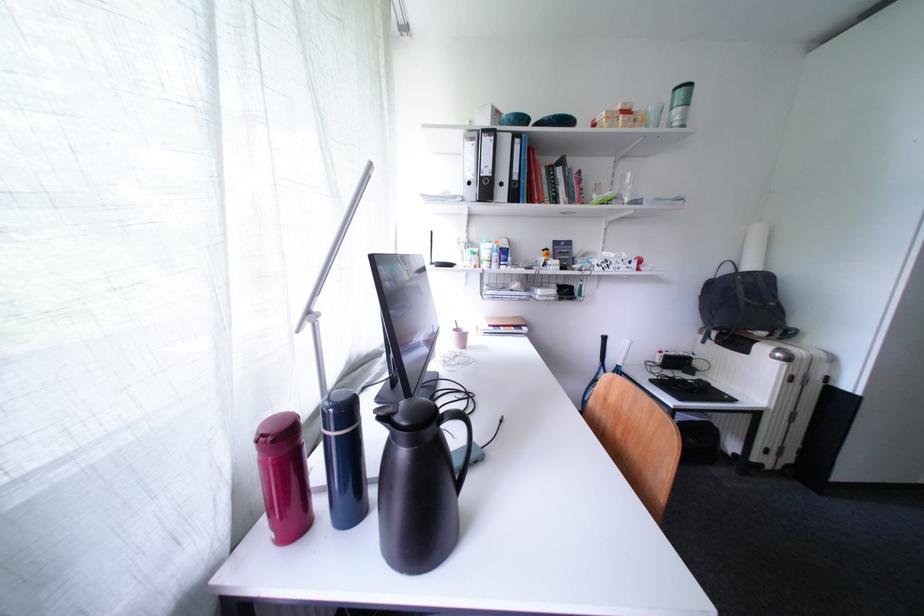
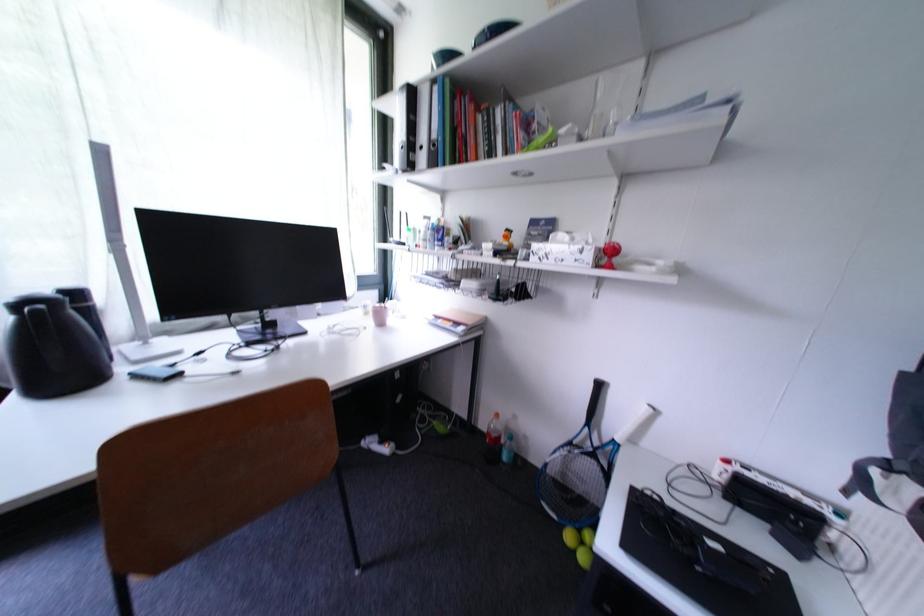
In the second image, find the point that corresponds to point (508, 187) in the first image.

(430, 150)